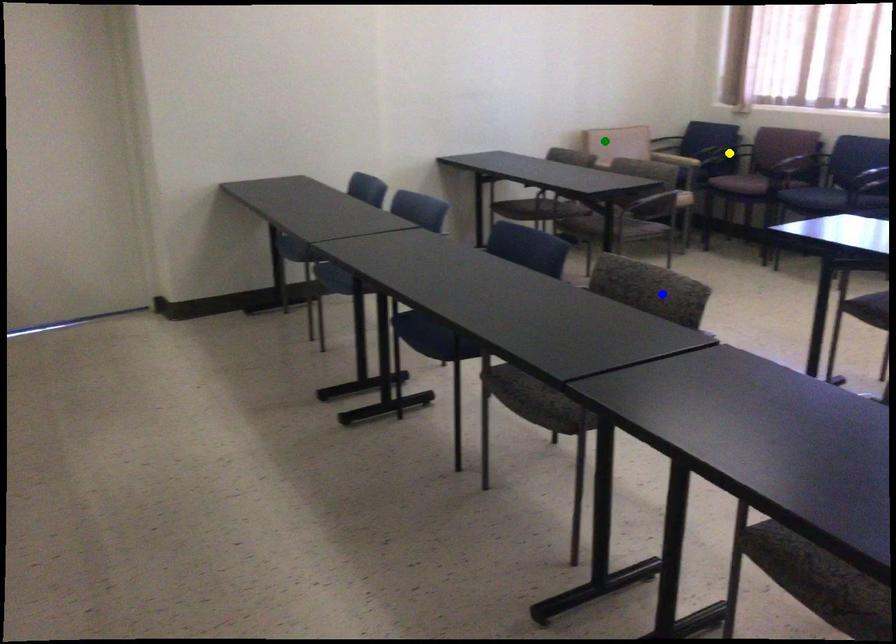
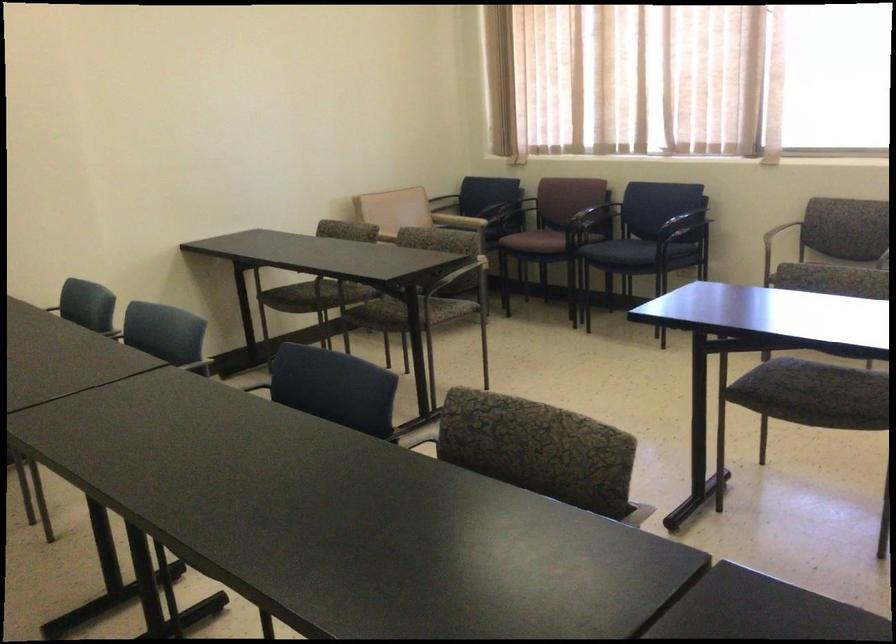
I am providing you with two images of the same scene from different viewpoints. Three points are marked in image1. Which point corresponds to a part or object that is occluded in image2?In image1, three points are marked. Which of them correspond to a part or object that is occluded in image2?Among the three points shown in image1, which one corresponds to a part or object that is no longer visible due to occlusion in image2?

yellow point cannot be seen in image2.